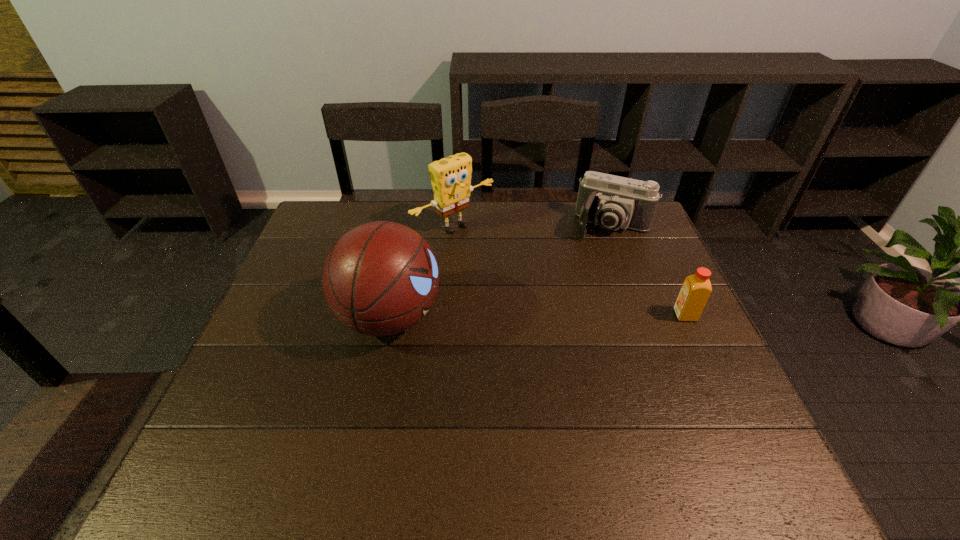
Image resolution: width=960 pixels, height=540 pixels. In order to click on vacant space located on the face of the sponge in this screenshot , I will do `click(545, 294)`.

Locate an element on the screen. This screenshot has height=540, width=960. blank space located 0.360m at the front of the camera with an open lens cover is located at coordinates (572, 318).

The height and width of the screenshot is (540, 960). Identify the location of vacant space located 0.230m at the front of the camera with an open lens cover. (584, 287).

Find the location of a particular element. This screenshot has height=540, width=960. vacant space positioned 0.320m at the front of the camera with an open lens cover is located at coordinates (576, 308).

Where is `sponge that is at the far edge`? Image resolution: width=960 pixels, height=540 pixels. sponge that is at the far edge is located at coordinates point(450,177).

Where is `camera that is at the far edge`? camera that is at the far edge is located at coordinates (613, 202).

Where is `orange juice located at the right edge`? orange juice located at the right edge is located at coordinates (696, 289).

The width and height of the screenshot is (960, 540). In order to click on camera situated at the right edge in this screenshot , I will do `click(613, 202)`.

Locate an element on the screen. This screenshot has height=540, width=960. object located in the far right corner section of the desktop is located at coordinates (613, 202).

Image resolution: width=960 pixels, height=540 pixels. I want to click on blank space at the far edge, so click(479, 202).